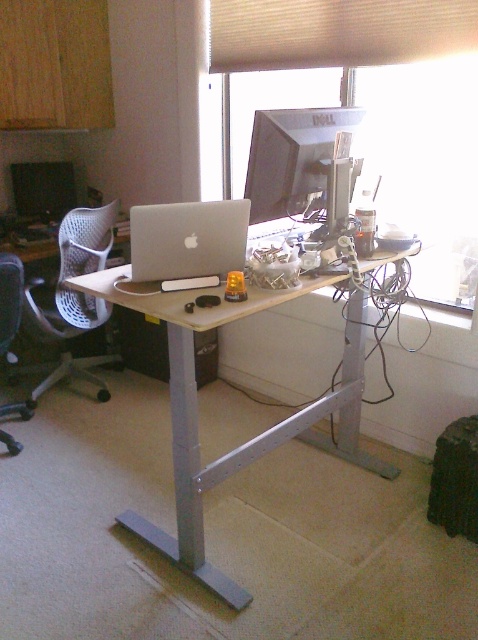
Question: Which of the following is the farthest from the observer?

Choices:
 (A) (78, 321)
 (B) (444, 22)
 (C) (204, 321)

Answer: (A)

Question: Is transparent glass window at upper center below white mesh swivel chair at left?

Choices:
 (A) yes
 (B) no

Answer: (B)

Question: Does white mesh swivel chair at left appear over silver metallic laptop at center?

Choices:
 (A) no
 (B) yes

Answer: (A)

Question: Considering the relative positions of transparent glass window at upper center and light brown wood desk at center in the image provided, where is transparent glass window at upper center located with respect to light brown wood desk at center?

Choices:
 (A) left
 (B) right

Answer: (B)

Question: Estimate the real-world distances between objects in this image. Which object is farther from the light brown wood desk at center?

Choices:
 (A) white mesh swivel chair at left
 (B) black fabric office chair at left
 (C) beige fabric blind at upper center

Answer: (C)

Question: Which point is closer to the camera?

Choices:
 (A) silver metallic laptop at center
 (B) black fabric office chair at left
 (C) beige fabric blind at upper center

Answer: (A)